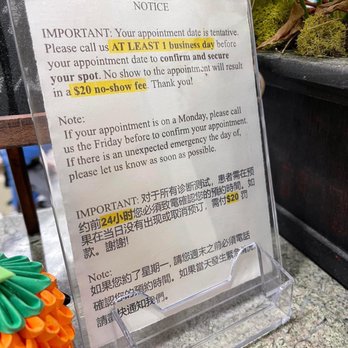
Where is `bar`? bar is located at coordinates (24, 130).